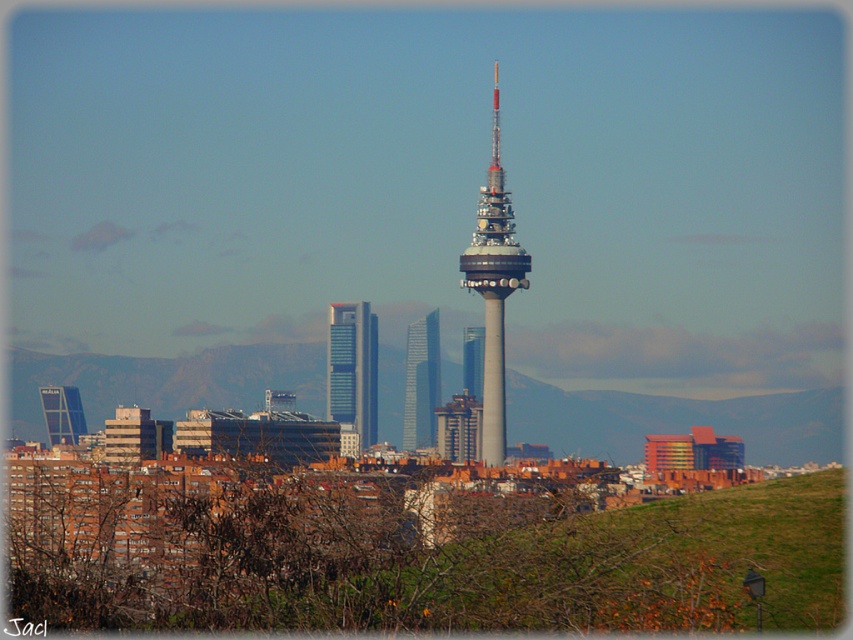
Question: Which point is farther to the camera?

Choices:
 (A) (364, 387)
 (B) (479, 349)

Answer: (B)

Question: Which point is farther from the camera taking this photo?

Choices:
 (A) (480, 275)
 (B) (68, 436)
 (C) (479, 392)

Answer: (B)

Question: Does gray metallic tower at center appear on the left side of matte glass skyscraper at center?

Choices:
 (A) yes
 (B) no

Answer: (B)

Question: Based on their relative distances, which object is nearer to the silver glass skyscraper at center?

Choices:
 (A) matte glass skyscraper at center
 (B) sleek glass skyscraper at center
 (C) gray metallic tower at center

Answer: (B)

Question: In this image, where is gray metallic tower at center located relative to silver glass skyscraper at center?

Choices:
 (A) right
 (B) left

Answer: (A)

Question: Is the position of gray metallic tower at center more distant than that of sleek glass skyscraper at center?

Choices:
 (A) no
 (B) yes

Answer: (A)